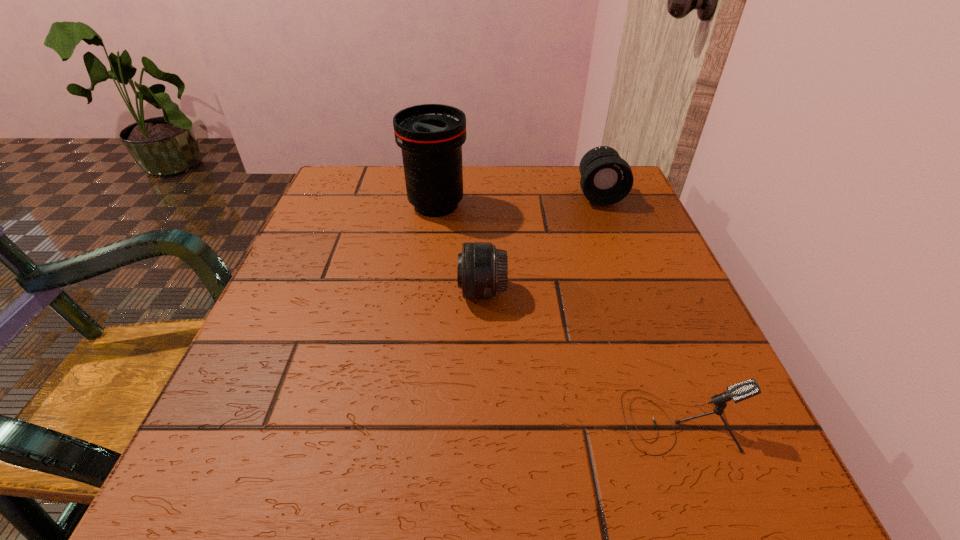
Find the location of a particular element. empty space that is in between the microphone and the rightmost telephoto lens is located at coordinates (638, 308).

At what (x,y) coordinates should I click in order to perform the action: click on free space between the nearest object and the tallest object. Please return your answer as a coordinate pair (x, y). The image size is (960, 540). Looking at the image, I should click on (558, 313).

At what (x,y) coordinates should I click in order to perform the action: click on empty location between the microphone and the nearest telephoto lens. Please return your answer as a coordinate pair (x, y). The image size is (960, 540). Looking at the image, I should click on (581, 356).

At what (x,y) coordinates should I click in order to perform the action: click on free space between the third farthest object and the nearest object. Please return your answer as a coordinate pair (x, y). This screenshot has height=540, width=960. Looking at the image, I should click on (581, 356).

The width and height of the screenshot is (960, 540). What are the coordinates of `unoccupied area between the microphone and the rightmost telephoto lens` in the screenshot? It's located at (638, 308).

Locate an element on the screen. the third closest object to the rightmost telephoto lens is located at coordinates (738, 392).

Identify which object is the third nearest to the third farthest object. Please provide its 2D coordinates. Your answer should be formatted as a tuple, i.e. [(x, y)], where the tuple contains the x and y coordinates of a point satisfying the conditions above.

[(606, 179)]

Image resolution: width=960 pixels, height=540 pixels. I want to click on telephoto lens object that ranks as the third closest to the microphone, so click(x=606, y=179).

This screenshot has height=540, width=960. I want to click on the closest telephoto lens to the nearest telephoto lens, so click(431, 136).

The image size is (960, 540). I want to click on free space that satisfies the following two spatial constraints: 1. at the front element of the rightmost telephoto lens; 2. on the stand of the nearest object, so click(x=684, y=421).